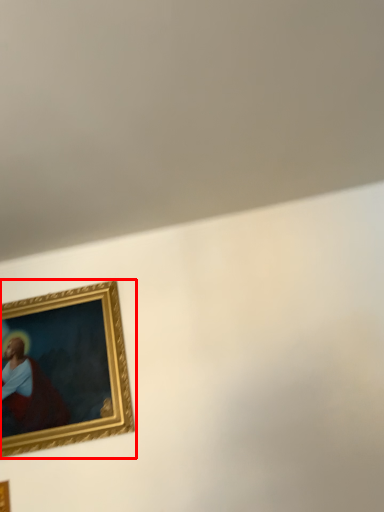
Question: Observing the image, what is the correct spatial positioning of picture frame (annotated by the red box) in reference to picture frame?

Choices:
 (A) left
 (B) right

Answer: (B)